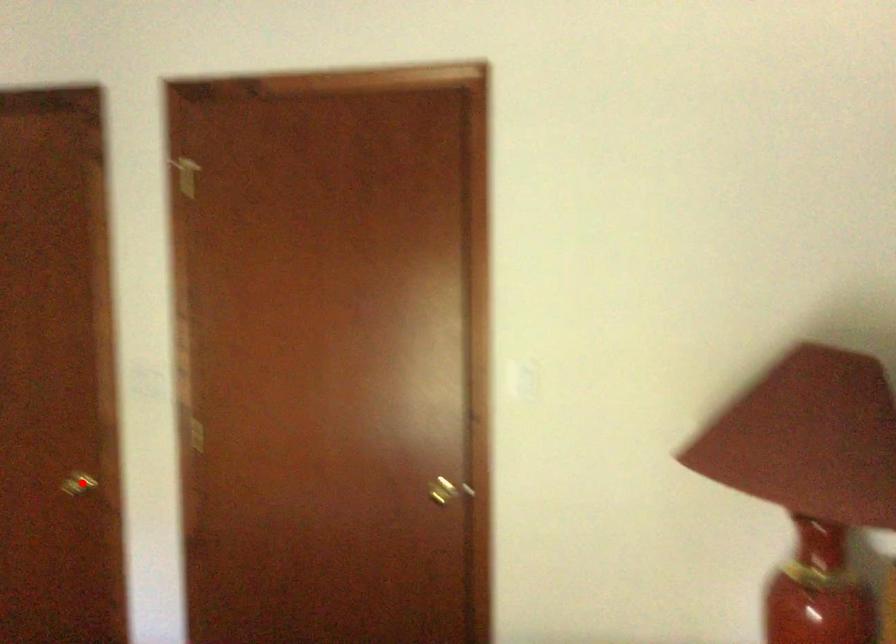
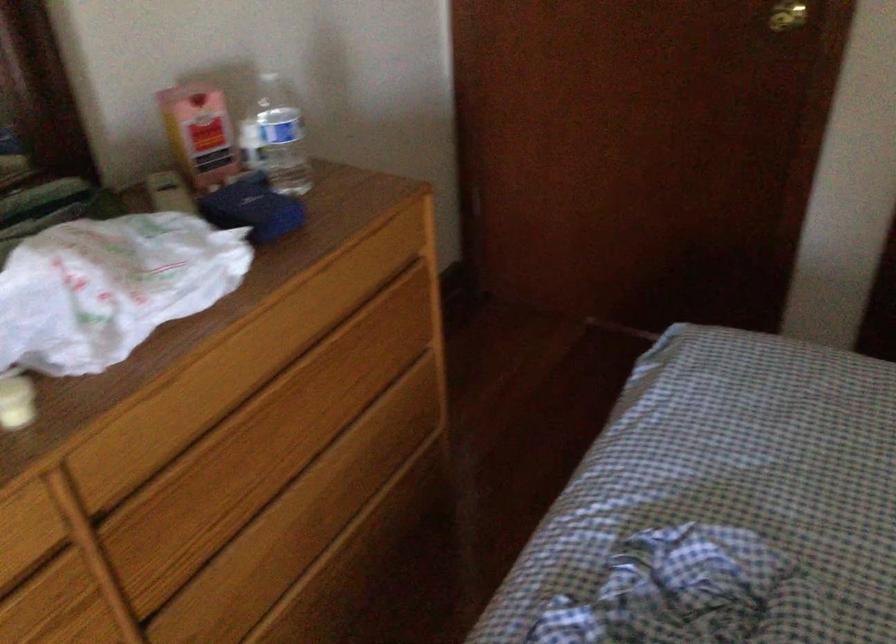
Question: I am providing you with two images of the same scene from different viewpoints. A red point is shown in image1. For the corresponding object point in image2, is it positioned nearer or farther from the camera?

Choices:
 (A) Nearer
 (B) Farther

Answer: (A)